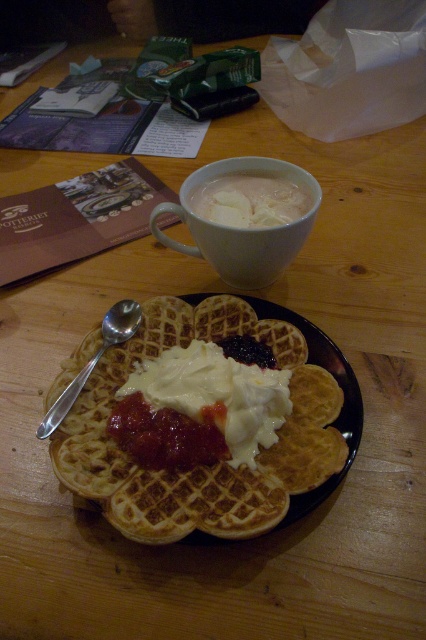
You are a photographer setting up a shot of the breakfast scene. You want to focus on the white matte mug at upper center. If your camera can only focus on objects within 20 inches, will it be able to focus on the mug?

The white matte mug at upper center is 21.01 inches away from camera, which is beyond the camera focus range of 20 inches. Therefore, the camera cannot focus on the mug.

Consider the image. You are setting up a small tray for a guest and need to place both the white matte mug at upper center and the silver metallic spoon at left on it. Given that the tray is only wide enough to accommodate one item, which item should you choose to fit on the tray?

The white matte mug at upper center is wider than the silver metallic spoon at left, so you should choose the silver metallic spoon at left to fit on the tray since it is narrower.